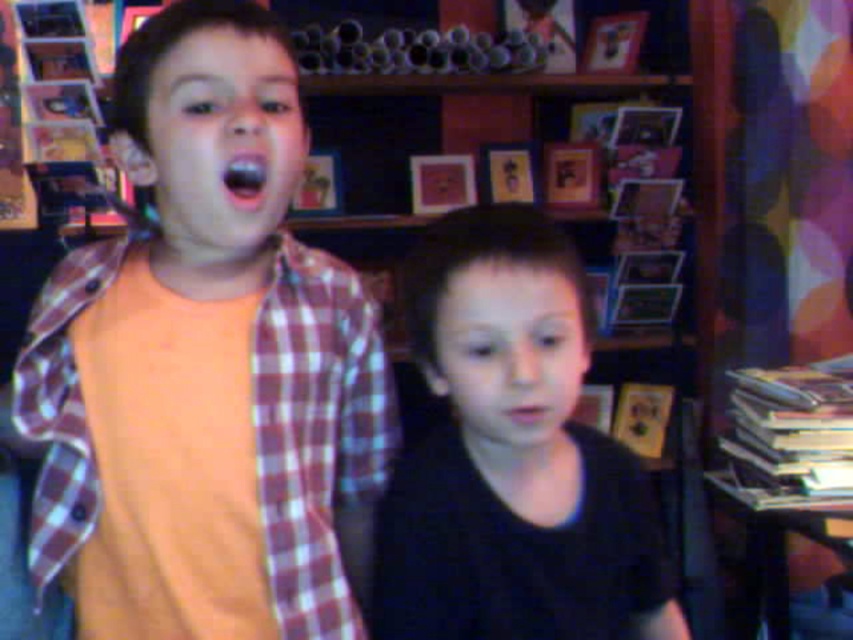
Question: Among these points, which one is farthest from the camera?

Choices:
 (A) (274, 458)
 (B) (585, 579)

Answer: (A)

Question: Can you confirm if black matte shirt at center is smaller than orange cotton shirt at left?

Choices:
 (A) yes
 (B) no

Answer: (B)

Question: Can you confirm if black matte shirt at center is wider than orange cotton shirt at left?

Choices:
 (A) yes
 (B) no

Answer: (B)

Question: Is black matte shirt at center smaller than orange cotton shirt at left?

Choices:
 (A) yes
 (B) no

Answer: (B)

Question: Among these points, which one is farthest from the camera?

Choices:
 (A) (425, 289)
 (B) (316, 488)

Answer: (B)

Question: Among these objects, which one is farthest from the camera?

Choices:
 (A) black matte shirt at center
 (B) orange cotton shirt at left

Answer: (B)